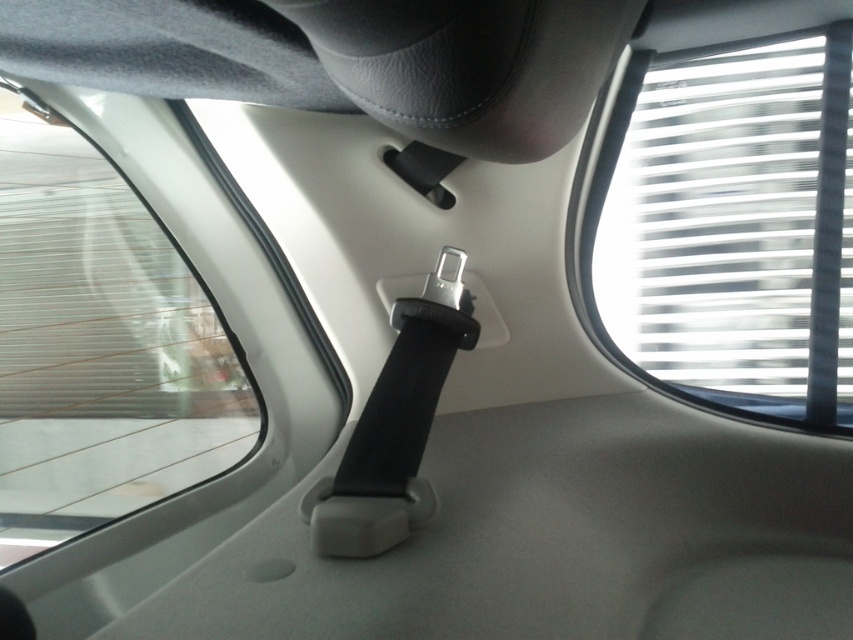
You are a passenger in the car and want to know if you can fully open the white translucent blinds at upper right to let more light in without blocking the view through the transparent glass window at center. Can you do that?

The white translucent blinds at upper right are narrower than the transparent glass window at center, so opening them fully won

You are sitting in the car and want to adjust the white translucent blinds at upper right to let in more light. Based on their current position, can you estimate where exactly they are located in the car?

The white translucent blinds at upper right are located at point coordinates of (730, 225), so they are positioned near the upper right corner of the car interior.

You are a passenger in the back seat of a car and want to look outside. You see the white translucent blinds at upper right and the transparent glass window at center. Which object allows you to see the outside view more clearly?

The transparent glass window at center allows you to see the outside view more clearly because it is transparent, while the white translucent blinds at upper right only allow light through but obscure the view.